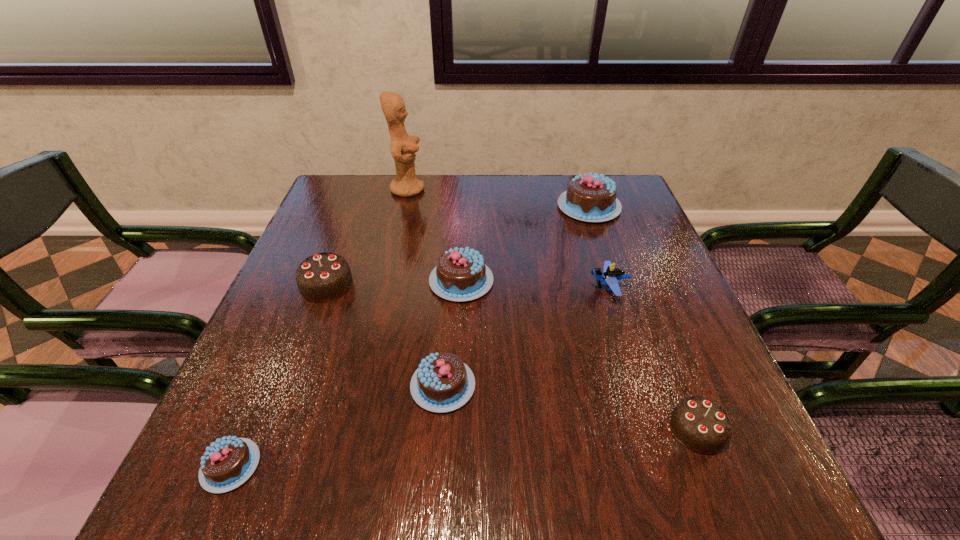
Image resolution: width=960 pixels, height=540 pixels. In the image, there is a desktop. What are the coordinates of `vacant area at the near edge` in the screenshot? It's located at (581, 466).

In the image, there is a desktop. Identify the location of free region at the left edge. The height and width of the screenshot is (540, 960). (368, 220).

Identify the location of free space at the right edge of the desktop. (641, 248).

At what (x,y) coordinates should I click in order to perform the action: click on blank space at the far left corner of the desktop. Please return your answer as a coordinate pair (x, y). Image resolution: width=960 pixels, height=540 pixels. Looking at the image, I should click on (333, 185).

Where is `vacant space at the near right corner of the desktop`? The image size is (960, 540). vacant space at the near right corner of the desktop is located at coordinates (766, 481).

Identify the location of free space between the smaller chocolate chocolate cake and the Lego. (653, 359).

Find the location of a particular element. This screenshot has width=960, height=540. blank region between the farthest chocolate cake and the second nearest pink chocolate cake is located at coordinates (516, 296).

What are the coordinates of `free spot between the tallest object and the rightmost pink chocolate cake` in the screenshot? It's located at (498, 198).

Locate an element on the screen. This screenshot has height=540, width=960. vacant space that is in between the bigger chocolate chocolate cake and the second farthest pink chocolate cake is located at coordinates (394, 283).

Where is `vacant space in between the farthest pink chocolate cake and the Lego`? vacant space in between the farthest pink chocolate cake and the Lego is located at coordinates (599, 247).